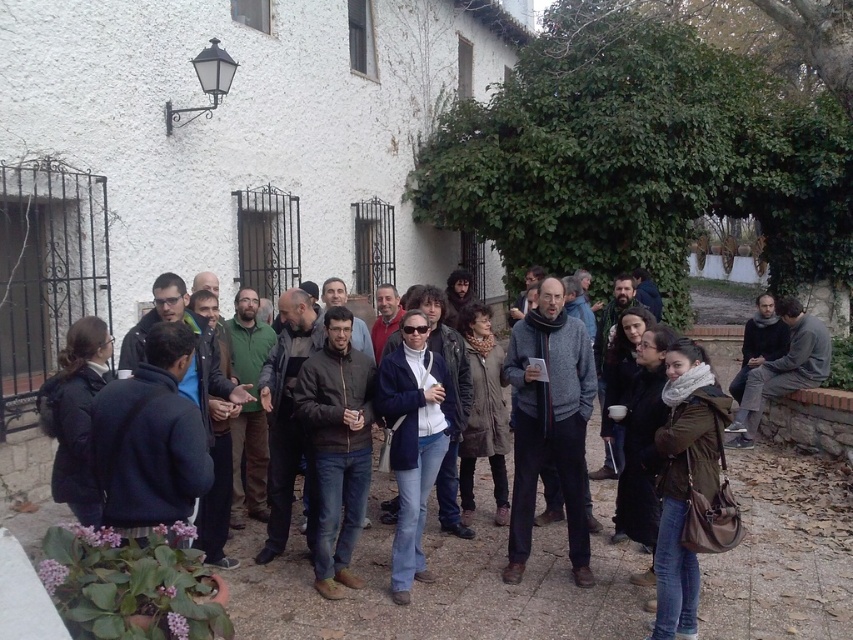
You are standing at the origin point of the coordinate system. You want to move towards the dark brown leather jacket at center. What are the coordinates you need to move to reach it?

The coordinates to reach the dark brown leather jacket at center are at point (450, 600).

You are organizing a photo shoot and need to ensure that the dark brown leather jacket at center and the dark gray sweater at center can fit side by side on a mannequin stand that is 1.2 meters wide. Based on the scene description, will they fit?

The dark brown leather jacket at center is larger in width than the dark gray sweater at center. However, without knowing the exact widths of both items, it is impossible to determine if their combined width exceeds 1.2 meters. Additional measurements are needed.

You are a photographer trying to capture a group photo of the dark brown leather jacket at center and the dark gray sweater at center. Since you want both to appear equally prominent in the photo, which object should you move closer to the camera?

The dark brown leather jacket at center has a larger size compared to dark gray sweater at center, so you should move the dark gray sweater at center closer to the camera to balance their sizes in the photo.